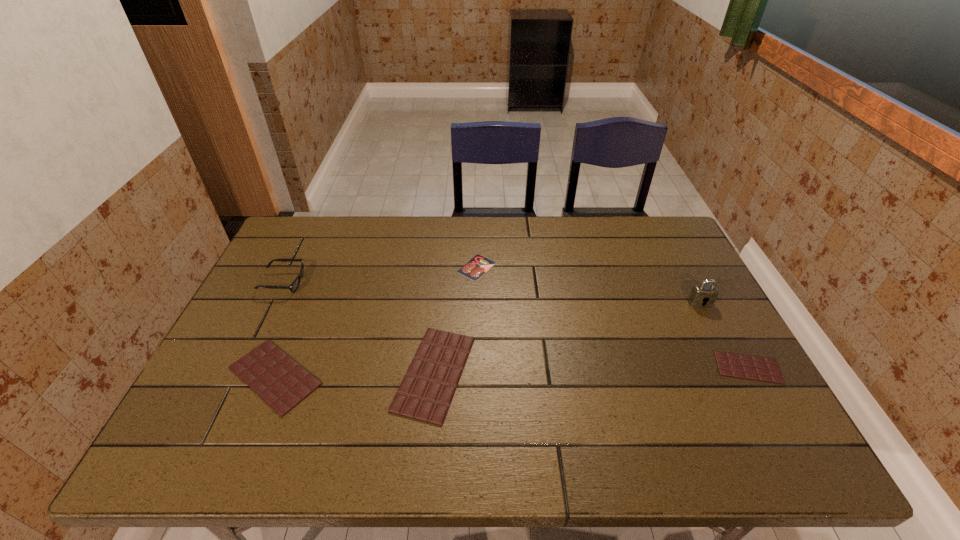
The height and width of the screenshot is (540, 960). Find the location of `object positioned at the near left corner`. object positioned at the near left corner is located at coordinates (280, 381).

The height and width of the screenshot is (540, 960). In order to click on blank area at the far edge in this screenshot , I will do `click(540, 231)`.

Image resolution: width=960 pixels, height=540 pixels. In the image, there is a desktop. What are the coordinates of `vacant area at the near edge` in the screenshot? It's located at (456, 401).

At what (x,y) coordinates should I click in order to perform the action: click on vacant space at the left edge of the desktop. Please return your answer as a coordinate pair (x, y). Looking at the image, I should click on (276, 316).

In the image, there is a desktop. Find the location of `vacant region at the far left corner`. vacant region at the far left corner is located at coordinates (304, 238).

Identify the location of free space at the near left corner of the desktop. tap(234, 398).

Locate an element on the screen. The width and height of the screenshot is (960, 540). vacant space at the far right corner of the desktop is located at coordinates (662, 242).

Identify the location of vacant region at the near right corner of the desktop. The width and height of the screenshot is (960, 540). (695, 387).

Locate an element on the screen. The height and width of the screenshot is (540, 960). unoccupied position between the second chocolate bar from right to left and the padlock is located at coordinates (567, 338).

Where is `free area in between the fifth tallest object and the fifth shortest object`? free area in between the fifth tallest object and the fifth shortest object is located at coordinates (516, 325).